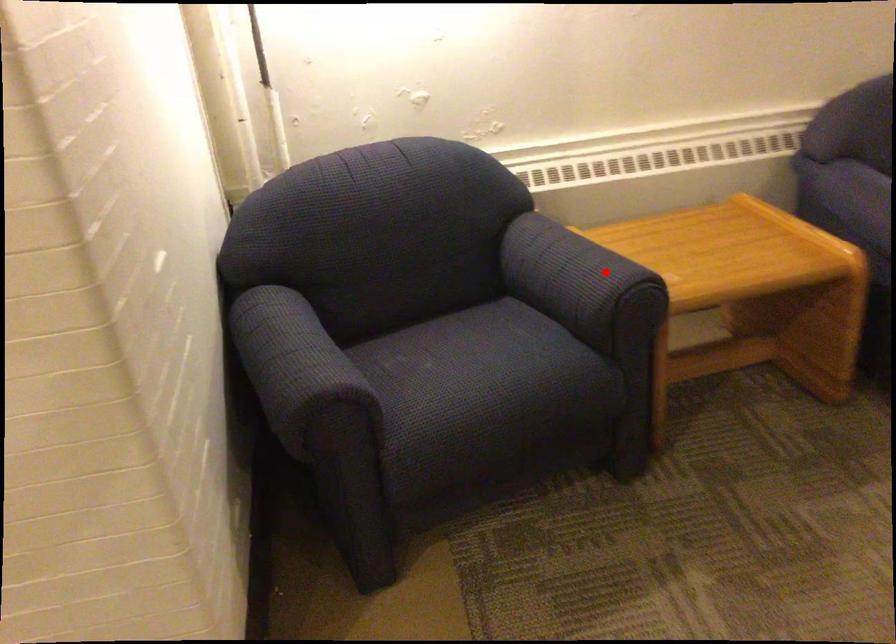
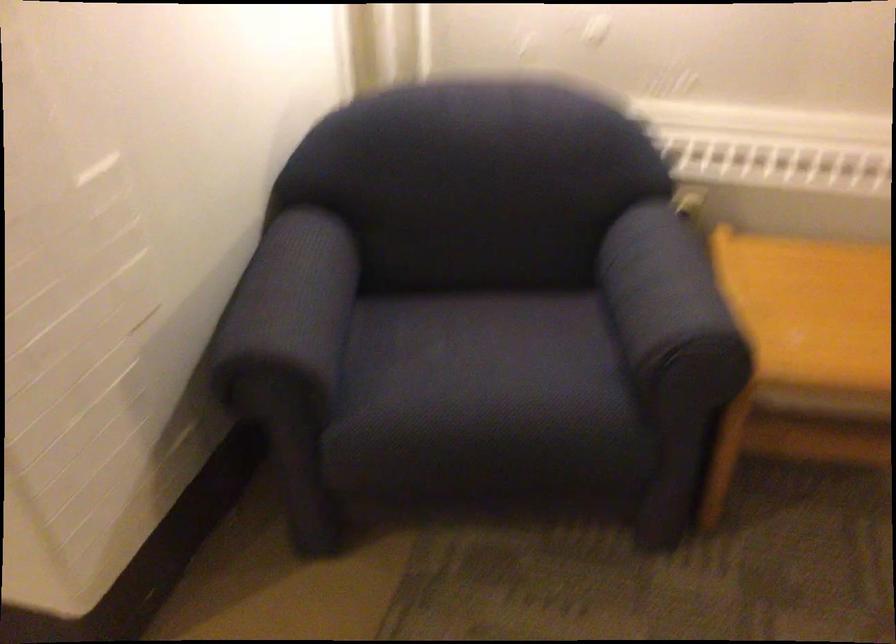
Question: I am providing you with two images of the same scene from different viewpoints. A red point is shown in image1. For the corresponding object point in image2, is it positioned nearer or farther from the camera?

Choices:
 (A) Nearer
 (B) Farther

Answer: (A)